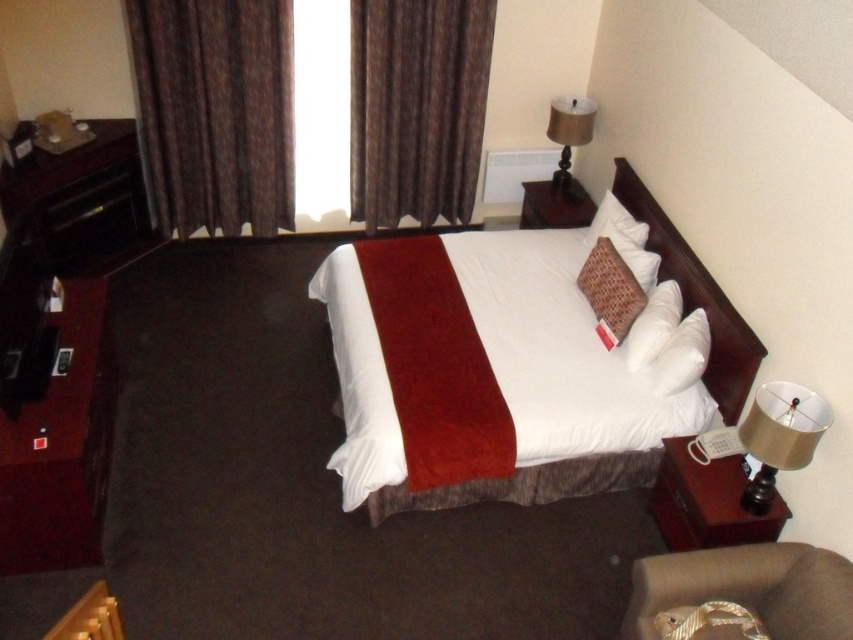
Which of these two, brown fabric curtain at upper left or woven brown pillow at upper right, stands shorter?

woven brown pillow at upper right is shorter.

Can you confirm if brown fabric curtain at upper left is positioned below woven brown pillow at upper right?

Result: Actually, brown fabric curtain at upper left is above woven brown pillow at upper right.

Between point (146, 84) and point (631, 272), which one is positioned in front?

Positioned in front is point (631, 272).

Find the location of a particular element. The width and height of the screenshot is (853, 640). brown fabric curtain at upper left is located at coordinates (215, 112).

Is brown fabric armchair at lower right thinner than white soft bed at center?

No.

Who is taller, brown fabric armchair at lower right or white soft bed at center?

Standing taller between the two is white soft bed at center.

Locate an element on the screen. brown fabric armchair at lower right is located at coordinates (741, 595).

Which is in front, point (740, 387) or point (813, 419)?

Point (813, 419)

Does dark wood headboard at upper right appear under metallic gold lampshade at right?

No, dark wood headboard at upper right is not below metallic gold lampshade at right.

Describe the element at coordinates (695, 298) in the screenshot. The image size is (853, 640). I see `dark wood headboard at upper right` at that location.

Image resolution: width=853 pixels, height=640 pixels. Find the location of `dark wood headboard at upper right`. dark wood headboard at upper right is located at coordinates (695, 298).